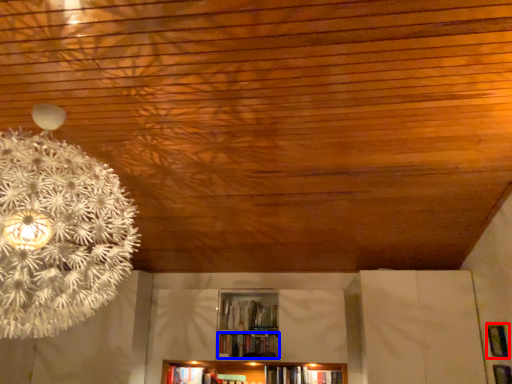
Question: Which of the following is the closest to the observer, panel (highlighted by a red box) or book (highlighted by a blue box)?

Choices:
 (A) panel
 (B) book

Answer: (A)